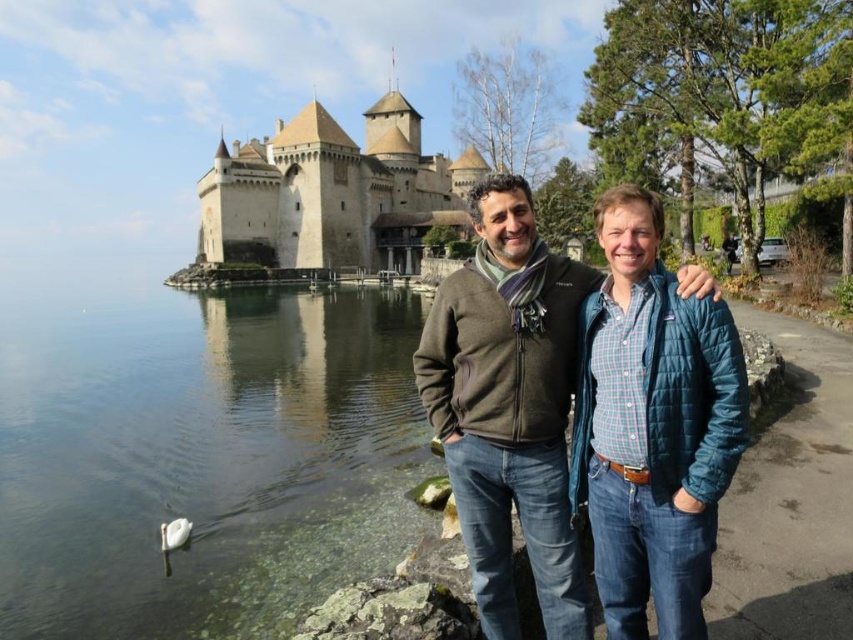
You are a photographer taking a picture of the stone medieval castle at upper center and the white matte swan at lower left. Which object should you focus on first if you want to capture both in sharp focus?

You should focus on the stone medieval castle at upper center first because it is closer to you than the white matte swan at lower left, so focusing on the closer object first will help ensure both are in focus.

You are standing at the point marked as point [415,397] in the image, which is 77.93 meters away from the viewer. If you want to walk towards the Chateau de Chillon in the background, which direction should you go?

Since the point is 77.93 meters away from the viewer, you should walk towards the Chateau de Chillon, which is in the background. The direction would be away from the viewer, towards the castle.